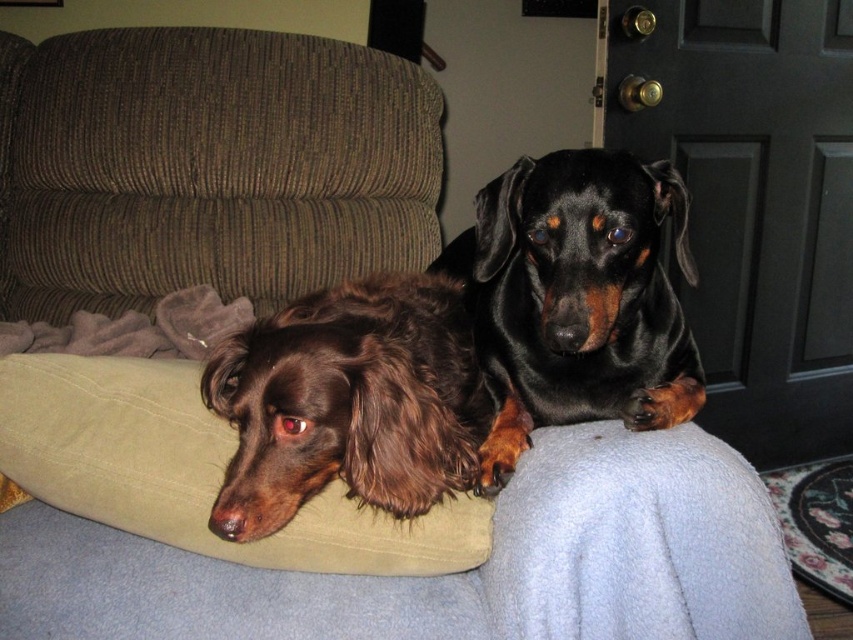
Question: Which point is farther to the camera?

Choices:
 (A) (651, 166)
 (B) (732, 476)

Answer: (A)

Question: Can you confirm if brown fuzzy dog at center is positioned to the right of suede-like beige pillow at lower left?

Choices:
 (A) yes
 (B) no

Answer: (A)

Question: Which of the following is the farthest from the observer?

Choices:
 (A) click(320, 497)
 (B) click(367, 330)
 (C) click(491, 228)
 (D) click(61, 429)

Answer: (C)

Question: Which object appears closest to the camera in this image?

Choices:
 (A) suede-like beige pillow at lower left
 (B) brown fuzzy dog at center
 (C) black shiny coat at upper center

Answer: (B)

Question: Is brown fuzzy dog at center wider than suede-like beige pillow at lower left?

Choices:
 (A) no
 (B) yes

Answer: (A)

Question: Is brown fabric dog bed at center bigger than brown fuzzy dog at center?

Choices:
 (A) no
 (B) yes

Answer: (B)